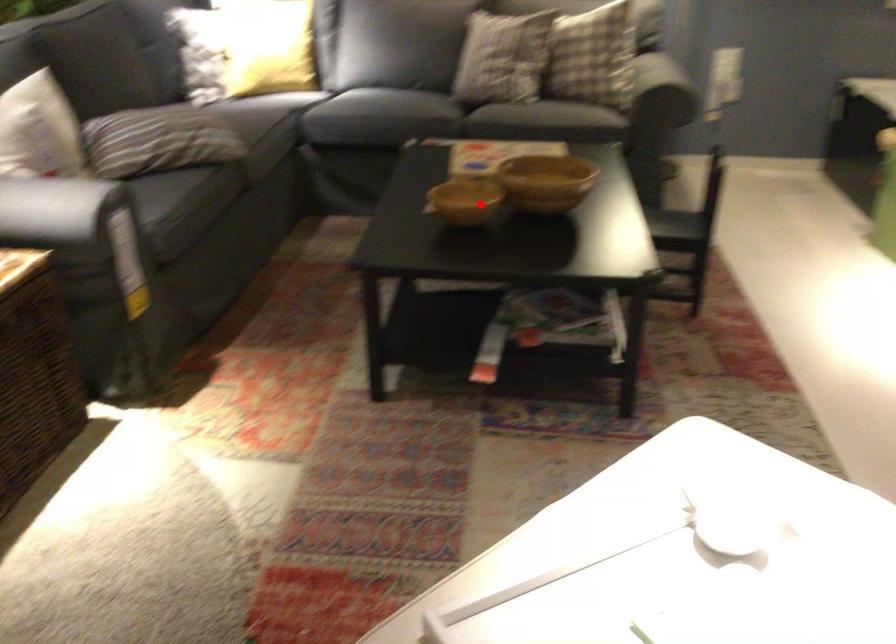
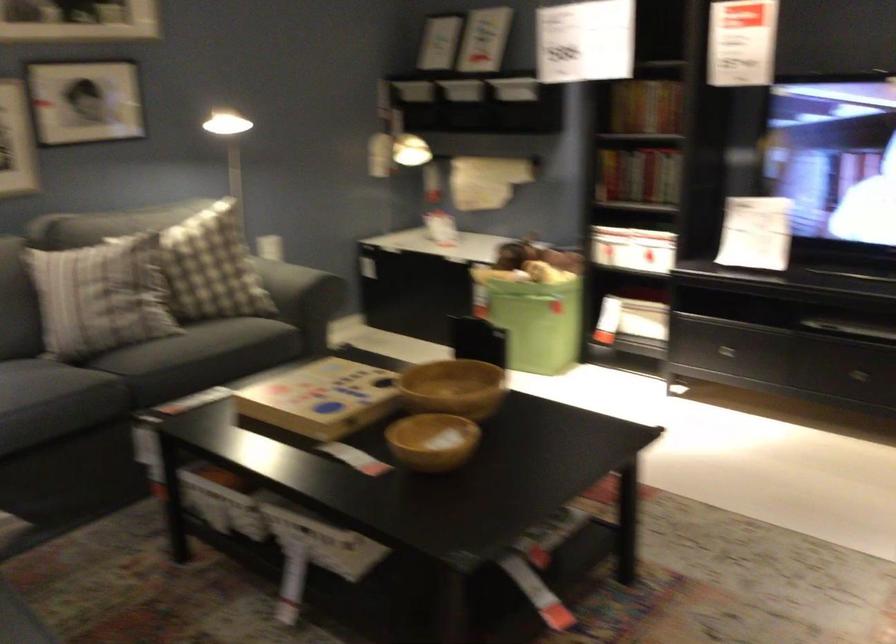
Question: I am providing you with two images of the same scene from different viewpoints. In image1, a red point is highlighted. Considering the same 3D point in image2, which of the following is correct?

Choices:
 (A) It is closer
 (B) It is farther

Answer: (A)